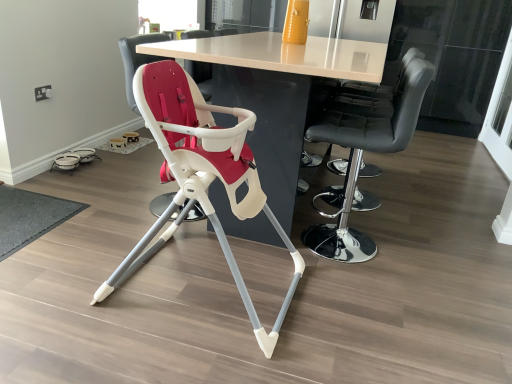
This screenshot has height=384, width=512. What do you see at coordinates (276, 92) in the screenshot? I see `white glossy table at center` at bounding box center [276, 92].

What is the approximate height of black leather bar stool at right, positioned as the first chair in right-to-left order?

36.66 inches.

Describe the element at coordinates (366, 150) in the screenshot. I see `black leather bar stool at right, marked as the third chair in a left-to-right arrangement` at that location.

Locate an element on the screen. Image resolution: width=512 pixels, height=384 pixels. white plastic highchair at center, the 1th chair when ordered from left to right is located at coordinates click(137, 60).

You are a GUI agent. You are given a task and a screenshot of the screen. Output one action in this format:
    pyautogui.click(x=<x>, y=<y>)
    Task: Click on the transparent glass screen door at upper right
    This screenshot has width=512, height=384.
    Given the screenshot: What is the action you would take?
    pyautogui.click(x=500, y=115)

Is white plastic highchair at center, arranged as the 3th chair when viewed from the right, positioned with its back to white glossy table at center?

That's right, white plastic highchair at center, arranged as the 3th chair when viewed from the right, is facing away from white glossy table at center.

From a real-world perspective, relative to white glossy table at center, is white plastic highchair at center, the 1th chair when ordered from left to right, vertically above or below?

From a real-world perspective, white plastic highchair at center, the 1th chair when ordered from left to right, is physically above white glossy table at center.

Who is taller, white plastic highchair at center, the 1th chair when ordered from left to right, or white glossy table at center?

With more height is white glossy table at center.

Can you confirm if transparent glass screen door at upper right is taller than white plastic highchair at center, the 1th chair when ordered from left to right?

Yes.

Where is `the 1st chair in front when counting from the transparent glass screen door at upper right`? Image resolution: width=512 pixels, height=384 pixels. the 1st chair in front when counting from the transparent glass screen door at upper right is located at coordinates (137, 60).

Is transparent glass screen door at upper right next to white plastic highchair at center, arranged as the 3th chair when viewed from the right?

transparent glass screen door at upper right is not next to white plastic highchair at center, arranged as the 3th chair when viewed from the right, and they're not touching.

Visually, is matte plastic highchair at center, positioned as the 2th chair in right-to-left order, positioned to the left or to the right of black leather bar stool at right, positioned as the first chair in right-to-left order?

Based on their positions, matte plastic highchair at center, positioned as the 2th chair in right-to-left order, is located to the left of black leather bar stool at right, positioned as the first chair in right-to-left order.

From the image's perspective, which one is positioned lower, matte plastic highchair at center, positioned as the 2th chair in right-to-left order, or black leather bar stool at right, positioned as the first chair in right-to-left order?

matte plastic highchair at center, positioned as the 2th chair in right-to-left order, appears lower in the image.

Between matte plastic highchair at center, the second chair viewed from the left, and black leather bar stool at right, marked as the third chair in a left-to-right arrangement, which one has larger width?

matte plastic highchair at center, the second chair viewed from the left.

Looking at this image, is white glossy table at center positioned with its back to transparent glass screen door at upper right?

That's not correct — white glossy table at center is not looking away from transparent glass screen door at upper right.

At what (x,y) coordinates should I click in order to perform the action: click on screen door above the white glossy table at center (from a real-world perspective). Please return your answer as a coordinate pair (x, y). Looking at the image, I should click on (500, 115).

Is white glossy table at center at the left side of transparent glass screen door at upper right?

Yes, white glossy table at center is to the left of transparent glass screen door at upper right.

Does point (291, 153) appear closer or farther from the camera than point (494, 120)?

Point (291, 153) is closer to the camera than point (494, 120).

Is white plastic highchair at center, the 1th chair when ordered from left to right, shorter than black leather bar stool at right, marked as the third chair in a left-to-right arrangement?

Yes.

In the scene shown: Can you see white plastic highchair at center, arranged as the 3th chair when viewed from the right, touching black leather bar stool at right, marked as the third chair in a left-to-right arrangement?

They are not placed beside each other.

From a real-world perspective, which is physically above, white plastic highchair at center, the 1th chair when ordered from left to right, or black leather bar stool at right, marked as the third chair in a left-to-right arrangement?

black leather bar stool at right, marked as the third chair in a left-to-right arrangement.

Considering the relative positions of white plastic highchair at center, the 1th chair when ordered from left to right, and black leather bar stool at right, marked as the third chair in a left-to-right arrangement, in the image provided, is white plastic highchair at center, the 1th chair when ordered from left to right, to the left of black leather bar stool at right, marked as the third chair in a left-to-right arrangement, from the viewer's perspective?

Correct, you'll find white plastic highchair at center, the 1th chair when ordered from left to right, to the left of black leather bar stool at right, marked as the third chair in a left-to-right arrangement.

From the image's perspective, which is below, transparent glass screen door at upper right or white glossy table at center?

From the image's view, white glossy table at center is below.

From the picture: In terms of height, does transparent glass screen door at upper right look taller or shorter compared to white glossy table at center?

Considering their sizes, transparent glass screen door at upper right has more height than white glossy table at center.

Is transparent glass screen door at upper right outside of white glossy table at center?

Yes, transparent glass screen door at upper right is located beyond the bounds of white glossy table at center.

Considering the sizes of white glossy table at center and black leather bar stool at right, positioned as the first chair in right-to-left order, in the image, is white glossy table at center wider or thinner than black leather bar stool at right, positioned as the first chair in right-to-left order,?

Clearly, white glossy table at center has more width compared to black leather bar stool at right, positioned as the first chair in right-to-left order.

Is white glossy table at center smaller than black leather bar stool at right, marked as the third chair in a left-to-right arrangement?

Actually, white glossy table at center might be larger than black leather bar stool at right, marked as the third chair in a left-to-right arrangement.

Considering the positions of objects white glossy table at center and black leather bar stool at right, marked as the third chair in a left-to-right arrangement, in the image provided, who is more to the left, white glossy table at center or black leather bar stool at right, marked as the third chair in a left-to-right arrangement,?

Positioned to the left is white glossy table at center.

Locate an element on the screen. Image resolution: width=512 pixels, height=384 pixels. table in front of the white plastic highchair at center, arranged as the 3th chair when viewed from the right is located at coordinates (276, 92).

Find the location of a particular element. This screenshot has height=384, width=512. screen door behind the white plastic highchair at center, arranged as the 3th chair when viewed from the right is located at coordinates (500, 115).

When comparing their distances from white glossy table at center, does transparent glass screen door at upper right or white plastic highchair at center, arranged as the 3th chair when viewed from the right, seem closer?

Among the two, white plastic highchair at center, arranged as the 3th chair when viewed from the right, is located nearer to white glossy table at center.

When comparing their distances from white plastic highchair at center, the 1th chair when ordered from left to right, does black leather bar stool at right, marked as the third chair in a left-to-right arrangement, or matte plastic highchair at center, positioned as the 2th chair in right-to-left order, seem further?

Based on the image, black leather bar stool at right, marked as the third chair in a left-to-right arrangement, appears to be further to white plastic highchair at center, the 1th chair when ordered from left to right.

Which object lies further to the anchor point matte plastic highchair at center, the second chair viewed from the left, white glossy table at center or transparent glass screen door at upper right?

transparent glass screen door at upper right is further to matte plastic highchair at center, the second chair viewed from the left.

Considering their positions, is matte plastic highchair at center, the second chair viewed from the left, positioned closer to white plastic highchair at center, arranged as the 3th chair when viewed from the right, than black leather bar stool at right, positioned as the first chair in right-to-left order?

The object closer to white plastic highchair at center, arranged as the 3th chair when viewed from the right, is matte plastic highchair at center, the second chair viewed from the left.

Which object lies further to the anchor point white plastic highchair at center, the 1th chair when ordered from left to right, transparent glass screen door at upper right or matte plastic highchair at center, the second chair viewed from the left?

transparent glass screen door at upper right lies further to white plastic highchair at center, the 1th chair when ordered from left to right, than the other object.

Considering their positions, is black leather bar stool at right, marked as the third chair in a left-to-right arrangement, positioned further to matte plastic highchair at center, positioned as the 2th chair in right-to-left order, than white plastic highchair at center, the 1th chair when ordered from left to right?

white plastic highchair at center, the 1th chair when ordered from left to right.

Which object lies further to the anchor point white glossy table at center, matte plastic highchair at center, positioned as the 2th chair in right-to-left order, or white plastic highchair at center, the 1th chair when ordered from left to right?

white plastic highchair at center, the 1th chair when ordered from left to right.

Looking at the image, which one is located closer to white plastic highchair at center, the 1th chair when ordered from left to right, white glossy table at center or black leather bar stool at right, positioned as the first chair in right-to-left order?

Based on the image, white glossy table at center appears to be nearer to white plastic highchair at center, the 1th chair when ordered from left to right.

Where is `chair located between matte plastic highchair at center, the second chair viewed from the left, and transparent glass screen door at upper right in the left-right direction`? This screenshot has height=384, width=512. chair located between matte plastic highchair at center, the second chair viewed from the left, and transparent glass screen door at upper right in the left-right direction is located at coordinates (366, 150).

This screenshot has width=512, height=384. What are the coordinates of `chair between white plastic highchair at center, the 1th chair when ordered from left to right, and black leather bar stool at right, positioned as the first chair in right-to-left order` in the screenshot? It's located at click(x=201, y=174).

Locate an element on the screen. This screenshot has height=384, width=512. table between matte plastic highchair at center, positioned as the 2th chair in right-to-left order, and white plastic highchair at center, the 1th chair when ordered from left to right, from front to back is located at coordinates (276, 92).

This screenshot has width=512, height=384. Identify the location of table situated between matte plastic highchair at center, the second chair viewed from the left, and black leather bar stool at right, positioned as the first chair in right-to-left order, from left to right. (276, 92).